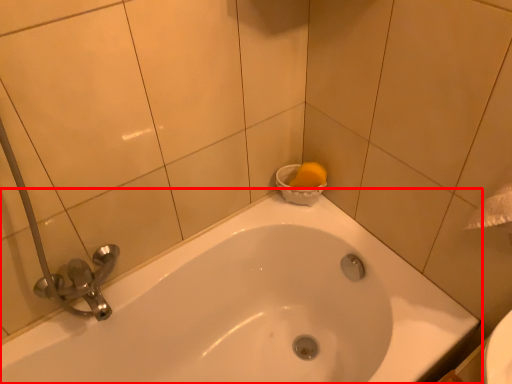
Question: From the image's perspective, where is bathtub (annotated by the red box) located relative to basin?

Choices:
 (A) below
 (B) above

Answer: (A)